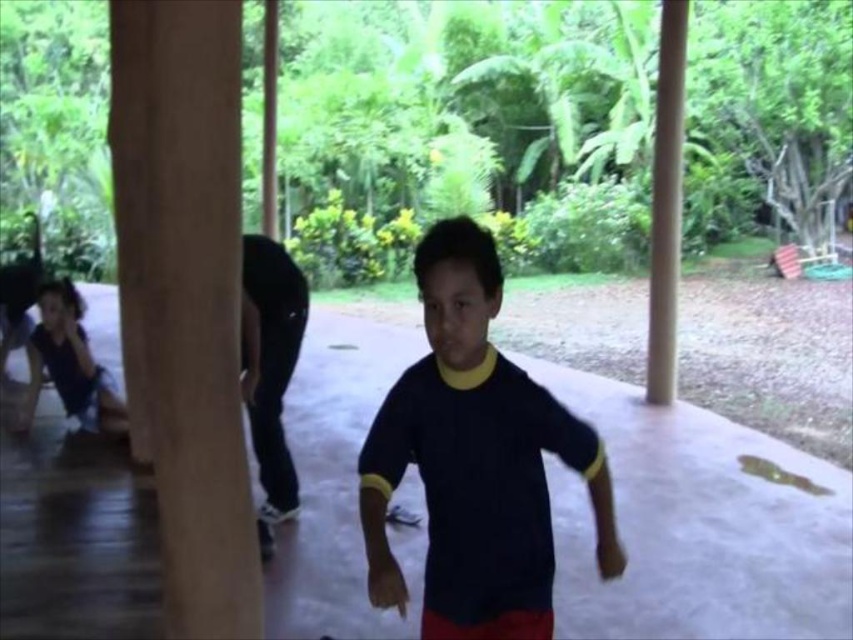
You are a photographer trying to capture the boy in the scene. Since you want to focus on the dark blue jersey at center and the black matte pants at center, which one should you adjust your camera focus on first to ensure clarity?

The dark blue jersey at center is closer to the viewer than the black matte pants at center, so you should focus on the dark blue jersey at center first to ensure clarity.

You are a fashion designer observing the image and need to create a new outfit. The black matte pants at center and the matte black shirt at left are part of the design. Which item has a narrower width?

The black matte pants at center has a lesser width compared to the matte black shirt at left, so the black matte pants at center is narrower.

You are a fashion designer observing the scene. You need to determine which clothing item is larger between the black matte pants at center and the matte black shirt at left. Based on the scene, which one is bigger?

The matte black shirt at left is larger than the black matte pants at center.